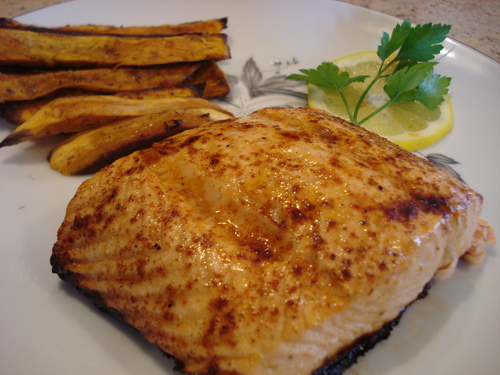
Where is `gray flower design on plate`? The height and width of the screenshot is (375, 500). gray flower design on plate is located at coordinates (264, 85).